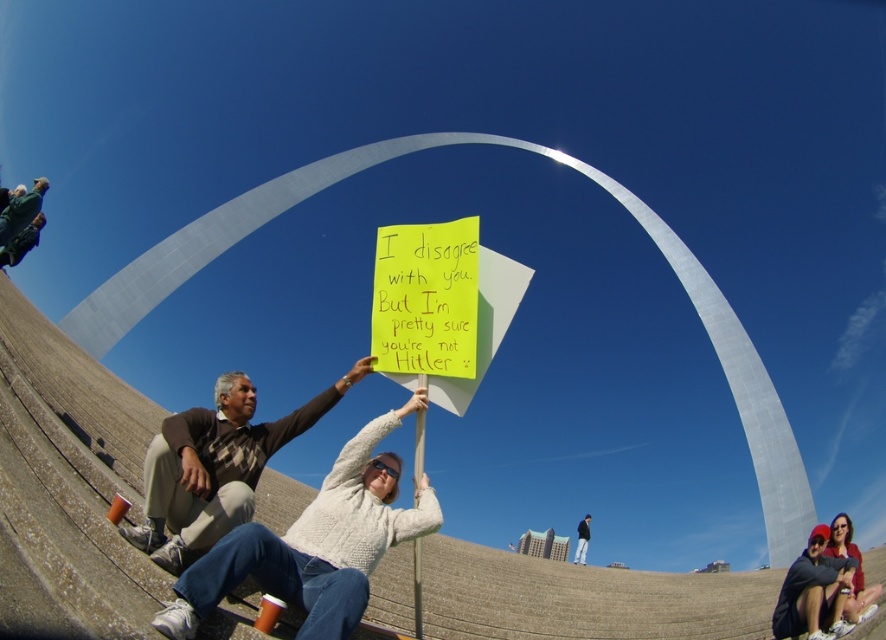
Is point (241, 497) more distant than point (584, 529)?

No, (241, 497) is closer to viewer.

Between brown sweater at center and dark blue jeans at lower right, which one has less height?

brown sweater at center is shorter.

What do you see at coordinates (215, 467) in the screenshot?
I see `brown sweater at center` at bounding box center [215, 467].

Locate an element on the screen. The image size is (886, 640). brown sweater at center is located at coordinates (215, 467).